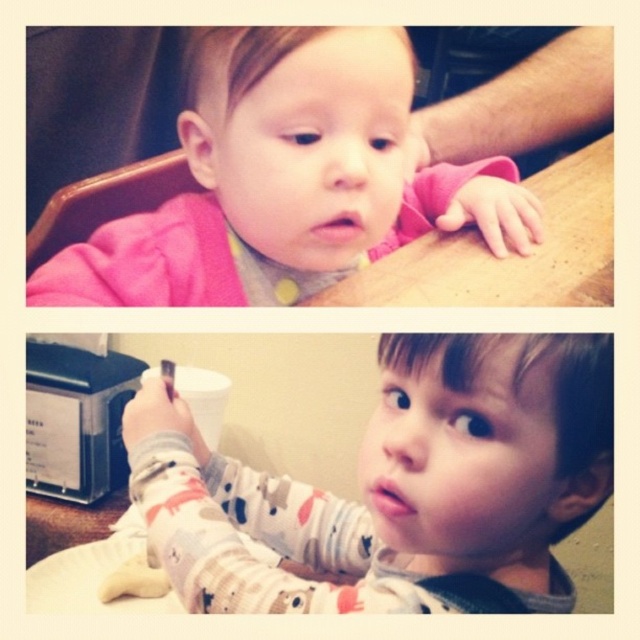
Who is taller, printed cotton pajamas at center or pink soft fabric toddler at upper center?

With more height is pink soft fabric toddler at upper center.

Looking at this image, does printed cotton pajamas at center have a greater height compared to pink soft fabric toddler at upper center?

Incorrect, printed cotton pajamas at center's height is not larger of pink soft fabric toddler at upper center's.

Which is behind, point (556, 493) or point (378, 140)?

Point (378, 140)

Identify the location of printed cotton pajamas at center. This screenshot has width=640, height=640. (397, 484).

Who is more distant from viewer, (x=512, y=548) or (x=561, y=275)?

Positioned behind is point (x=561, y=275).

Is printed cotton pajamas at center positioned before wooden table at upper center?

Yes.

Find the location of a particular element. printed cotton pajamas at center is located at coordinates (397, 484).

I want to click on printed cotton pajamas at center, so click(397, 484).

Between pink soft fabric toddler at upper center and wooden table at upper center, which one appears on the right side from the viewer's perspective?

From the viewer's perspective, wooden table at upper center appears more on the right side.

Identify the location of pink soft fabric toddler at upper center. (285, 179).

Identify the location of pink soft fabric toddler at upper center. Image resolution: width=640 pixels, height=640 pixels. (285, 179).